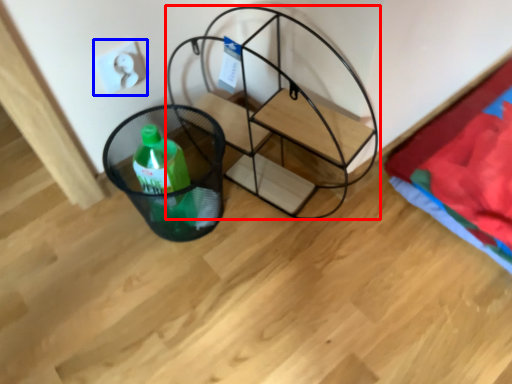
Question: Which point is further to the camera, furniture (highlighted by a red box) or electric outlet (highlighted by a blue box)?

Choices:
 (A) furniture
 (B) electric outlet

Answer: (B)